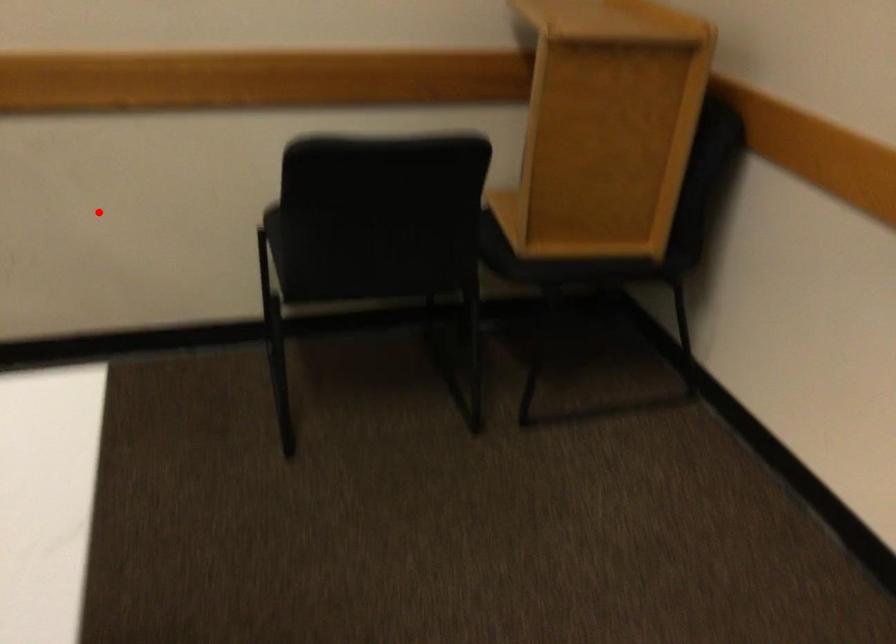
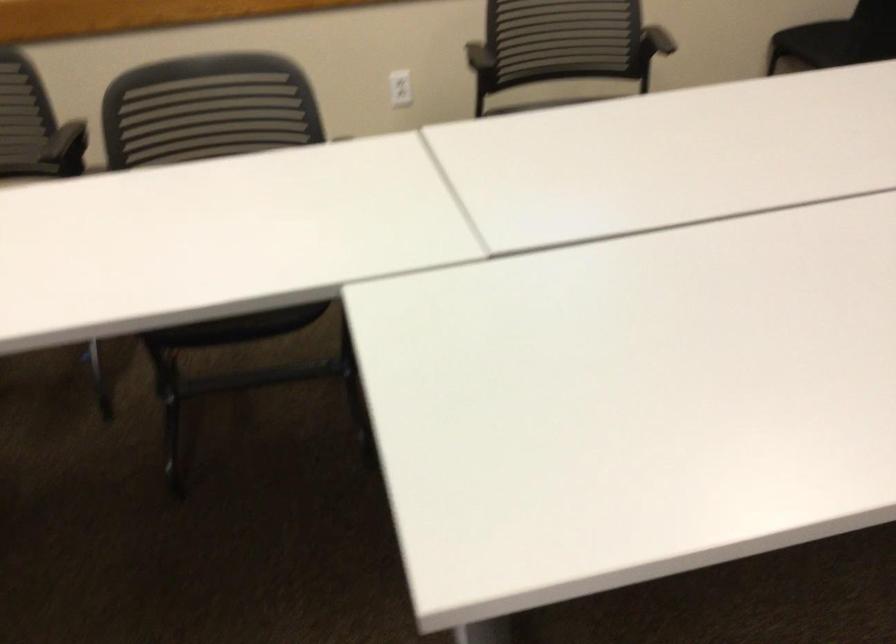
Question: I am providing you with two images of the same scene from different viewpoints. In image1, a red point is highlighted. Considering the same 3D point in image2, which of the following is correct?

Choices:
 (A) It is closer
 (B) It is farther

Answer: (B)